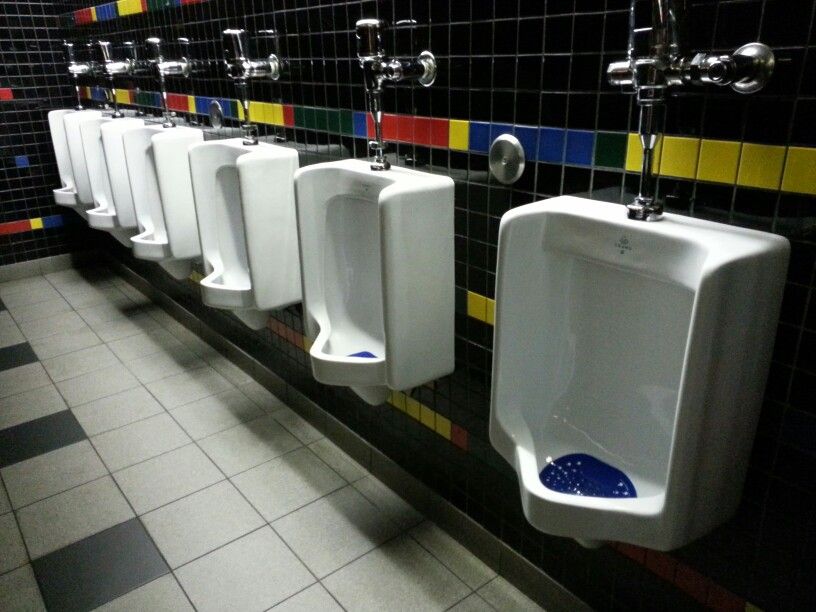
Where is `urinal`? This screenshot has width=816, height=612. urinal is located at coordinates (617, 319), (353, 215), (232, 185), (145, 154), (99, 136), (58, 129).